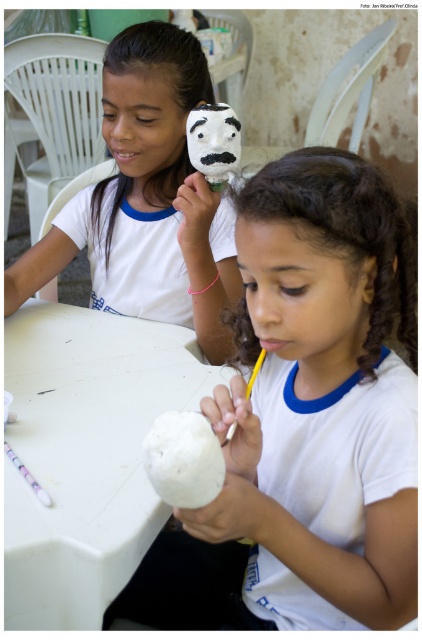
From the picture: You are a photographer trying to capture the smooth white face at center and the translucent plastic straw at lower left in the same frame. Which object should you focus on first to ensure both are in focus?

The smooth white face at center is in front of the translucent plastic straw at lower left, so you should focus on the smooth white face at center first to ensure both are in focus.

You are a photographer taking a picture of the two girls and their coconut shells. You notice two points in the image at coordinates point (346, 356) and point (21, 465). Which point will appear larger in your photo?

Point (346, 356) is closer to the camera than point (21, 465), so it will appear larger in the photo.